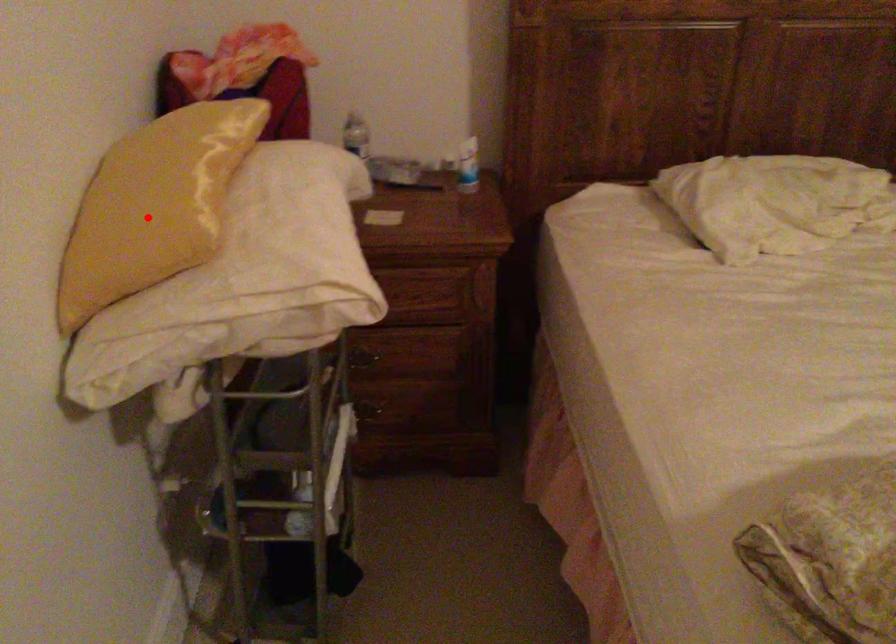
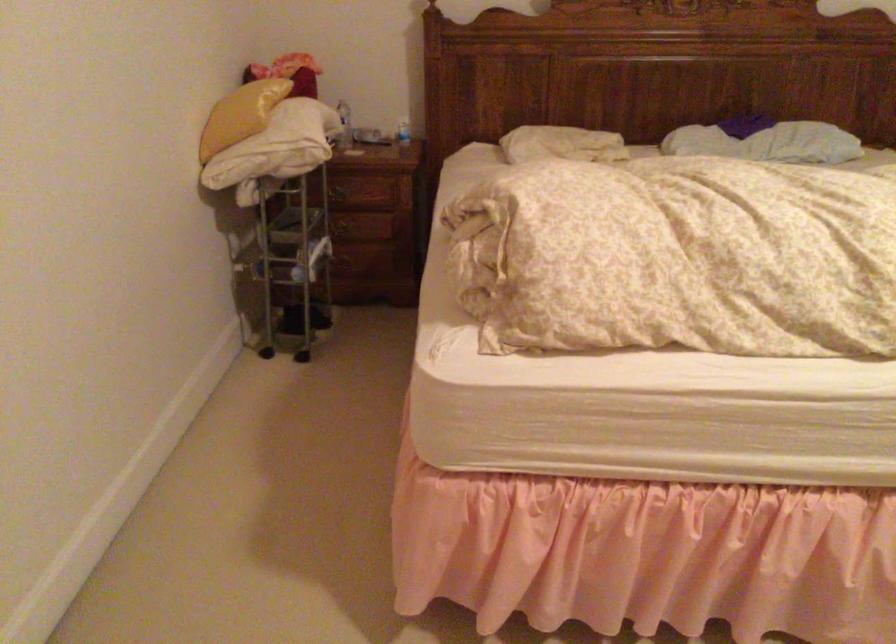
The point at the highlighted location is marked in the first image. Where is the corresponding point in the second image?

(240, 115)